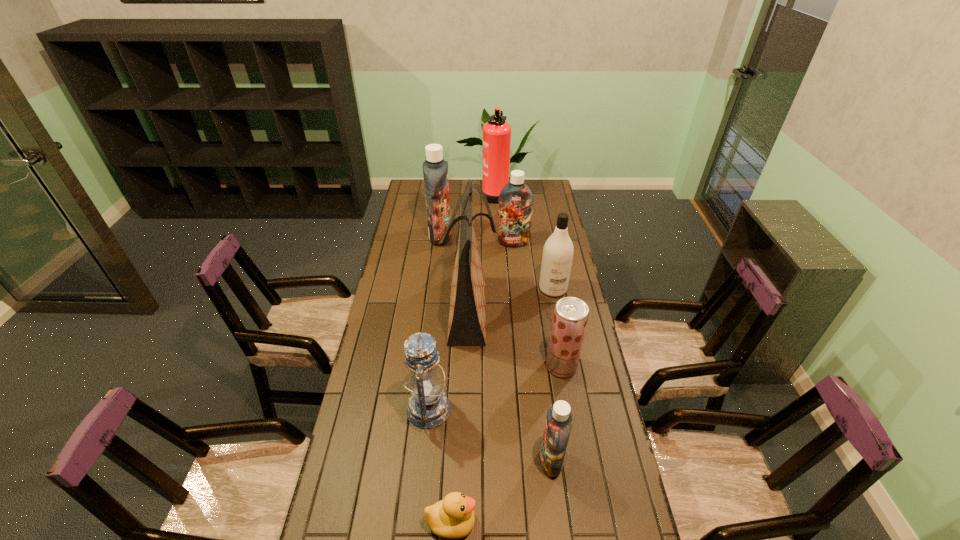
Where is `free region located on the front-facing side of the lantern`? This screenshot has height=540, width=960. free region located on the front-facing side of the lantern is located at coordinates (x=548, y=409).

You are a GUI agent. You are given a task and a screenshot of the screen. Output one action in this format:
    pyautogui.click(x=<x>, y=<y>)
    Task: Click on the vacant position located 0.240m on the left of the fourth nearest object
    
    Given the screenshot: What is the action you would take?
    pyautogui.click(x=477, y=366)

Image resolution: width=960 pixels, height=540 pixels. I want to click on vacant region located 0.150m on the front label of the nearest blue shampoo, so click(x=488, y=461).

Identify the location of free space located on the front label of the nearest blue shampoo. Image resolution: width=960 pixels, height=540 pixels. (429, 461).

Find the location of a particular element. This screenshot has width=960, height=540. free point located on the front label of the nearest blue shampoo is located at coordinates tap(440, 461).

At what (x,y) coordinates should I click in order to perform the action: click on object that is positioned at the far edge. Please return your answer as a coordinate pair (x, y). Looking at the image, I should click on pos(496,132).

This screenshot has width=960, height=540. Find the location of `object situated at the left edge`. object situated at the left edge is located at coordinates (435, 170).

Identify the location of shampoo that is at the right edge. The height and width of the screenshot is (540, 960). (557, 257).

The width and height of the screenshot is (960, 540). Identify the location of fruit juice situated at the right edge. (570, 317).

Find the location of a particular element. The height and width of the screenshot is (540, 960). free region at the left edge is located at coordinates (388, 340).